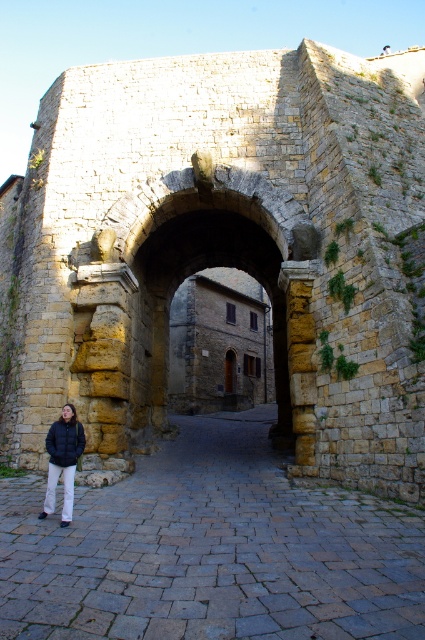
Does stone archway at center have a lesser height compared to dark blue puffer jacket at lower left?

No, stone archway at center is not shorter than dark blue puffer jacket at lower left.

Who is positioned more to the right, stone archway at center or dark blue puffer jacket at lower left?

Positioned to the right is stone archway at center.

The height and width of the screenshot is (640, 425). Describe the element at coordinates (221, 248) in the screenshot. I see `stone archway at center` at that location.

Where is `stone archway at center`? The height and width of the screenshot is (640, 425). stone archway at center is located at coordinates (221, 248).